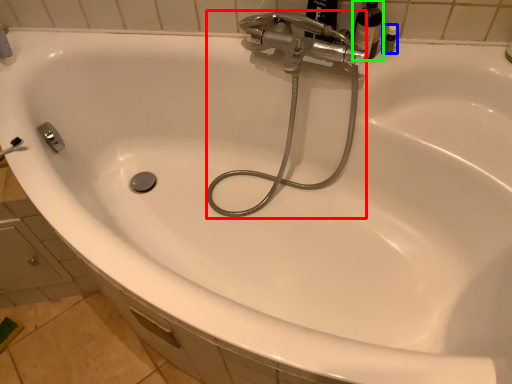
Question: Estimate the real-world distances between objects in this image. Which object is farther from plumbing fixture (highlighted by a red box), toiletry (highlighted by a blue box) or bottle (highlighted by a green box)?

Choices:
 (A) toiletry
 (B) bottle

Answer: (A)